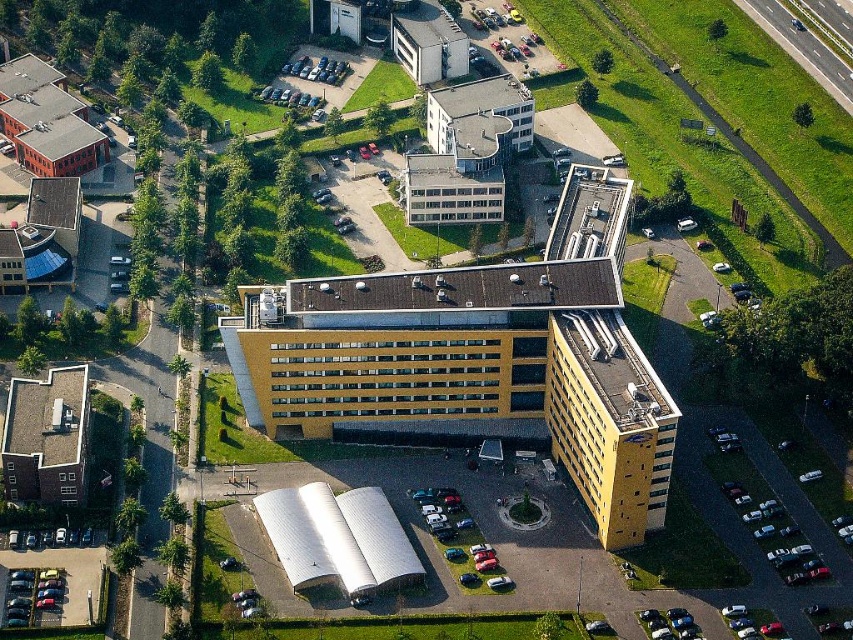
You are a drone operator who needs to deliver a package to the silver metallic antenna at lower center. Your drone has a maximum range of 100 meters. Can you safely deliver the package from the green grass at upper right without exceeding the drone range?

The distance between the green grass at upper right and the silver metallic antenna at lower center is 122.08 meters. Since the drone has a maximum range of 100 meters, it cannot safely deliver the package without exceeding its range.

You are a drone operator trying to capture a clear aerial photo of the silver metallic antenna at lower center without any obstructions. Based on the scene, will the green grass at upper right block your view of the antenna?

The silver metallic antenna at lower center is behind green grass at upper right, so the green grass at upper right will block the view of the antenna from above.